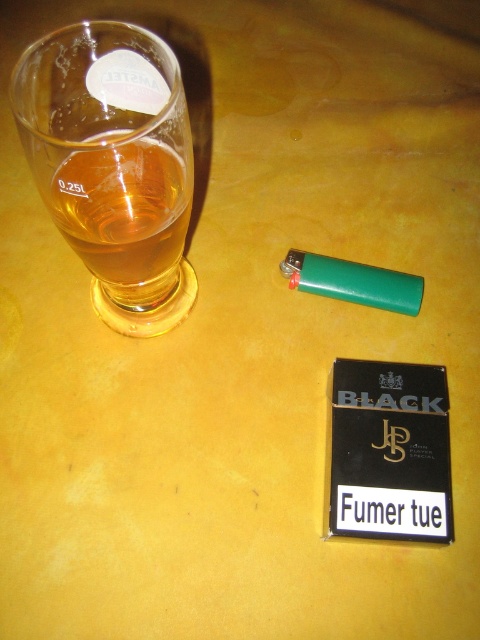
What is the position of the point with coordinates (x=113, y=164) in relation to the transparent glass beer at left?

The point with coordinates (x=113, y=164) is located on the transparent glass beer at left.

You are at a bar and want to grab the transparent glass beer at left and the translucent amber liquid at left. Which one is closer to your right hand if you are sitting directly in front of the table?

The translucent amber liquid at left is closer to your right hand because the transparent glass beer at left is to the right of it, placing the amber liquid further to the left.

You are holding a camera and want to take a closeup photo of the lighter located at point [57,220]. The camera is currently focused at 12 inches. Do you need to adjust the focus to capture the lighter clearly?

The point [57,220] is 13.52 inches from the camera, which is beyond the current focus distance of 12 inches. You need to adjust the focus to 13.52 inches to capture the lighter clearly.